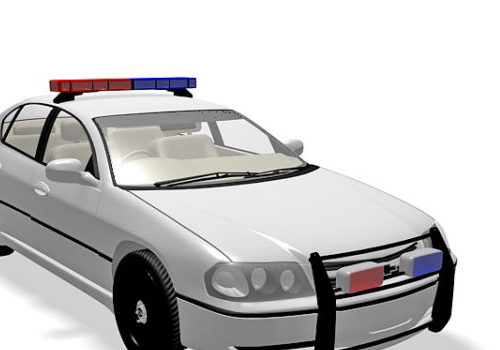
The image size is (500, 350). I want to click on door handle, so click(44, 186).